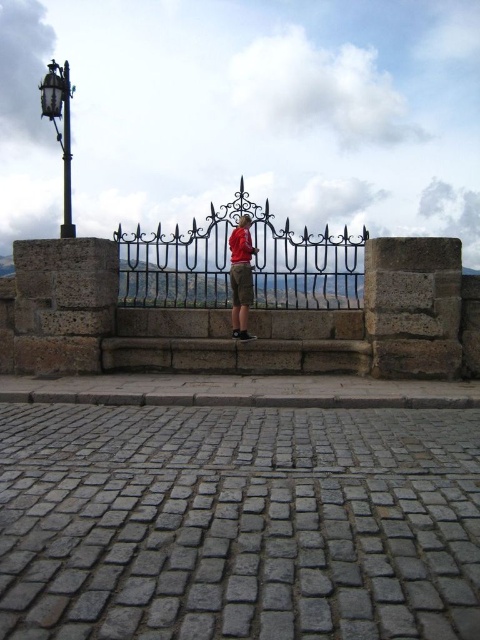
Can you confirm if wrought iron fence at center is positioned to the left of red shirt at center?

Indeed, wrought iron fence at center is positioned on the left side of red shirt at center.

Does point (289, 269) come farther from viewer compared to point (238, 323)?

That is True.

Describe the element at coordinates (252, 264) in the screenshot. I see `wrought iron fence at center` at that location.

Where is `wrought iron fence at center`? This screenshot has height=640, width=480. wrought iron fence at center is located at coordinates (252, 264).